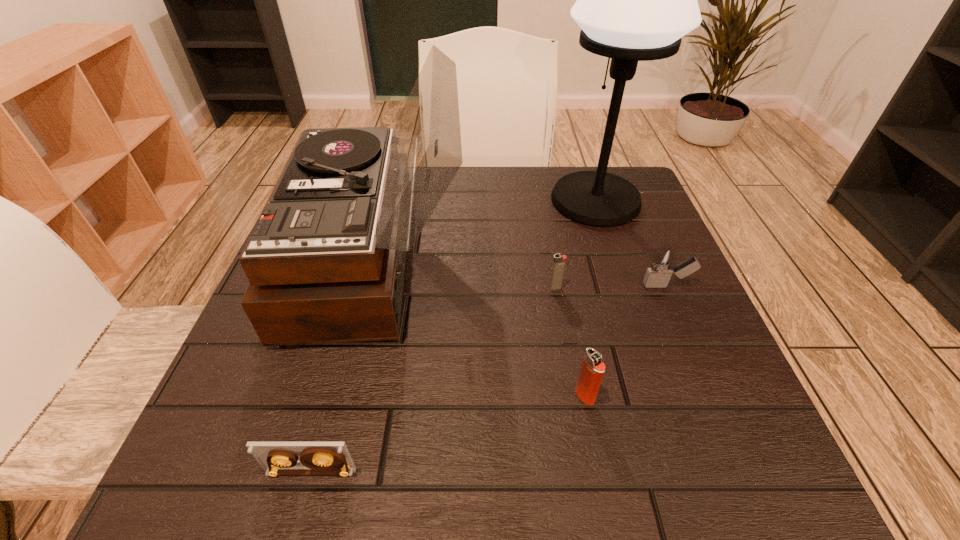
The width and height of the screenshot is (960, 540). I want to click on free area in between the rightmost igniter and the second tallest object, so click(x=522, y=273).

The height and width of the screenshot is (540, 960). What are the coordinates of `the closest object to the table lamp` in the screenshot? It's located at (662, 265).

This screenshot has width=960, height=540. In order to click on object that is the fourth closest to the nearest igniter in this screenshot , I will do `click(277, 458)`.

Select which igniter is the second closest to the nearest igniter. Please provide its 2D coordinates. Your answer should be formatted as a tuple, i.e. [(x, y)], where the tuple contains the x and y coordinates of a point satisfying the conditions above.

[(662, 265)]

Locate an element on the screen. igniter that is the second closest to the nearest igniter is located at coordinates (662, 265).